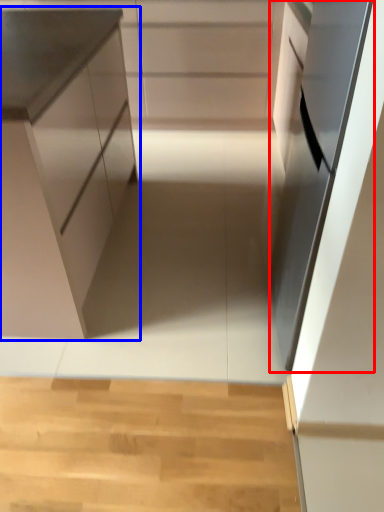
Question: Which point is closer to the camera, oven (highlighted by a red box) or cabinetry (highlighted by a blue box)?

Choices:
 (A) oven
 (B) cabinetry

Answer: (A)